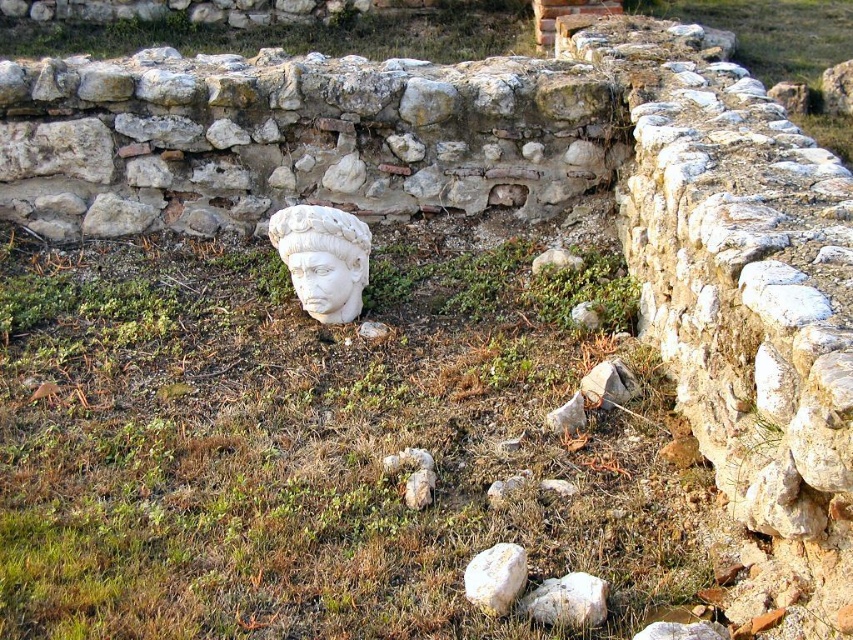
You are an archaeologist examining the site. You notice the green grass at center and the white smooth rock at center. Which object is taller when observed from above?

The green grass at center has a greater height compared to the white smooth rock at center, so the green grass at center is taller.

You are standing at the archaeological site and want to take a photo of the white marble head. The camera you are using has a focal length of 50mm and a sensor size of 24mm x 36mm. The point at coordinates point (532, 611) is where the marble head is located. To ensure the entire head fits in the frame, what is the minimum distance you should maintain from the head?

The minimum distance to maintain is 7.52 feet because that is the distance of point (532, 611) from the camera.

You are an archaeologist examining the site. You notice the green grass at center and the white smooth rock at center. Which object is positioned higher relative to the other?

The green grass at center is located above the white smooth rock at center, so it is positioned higher.